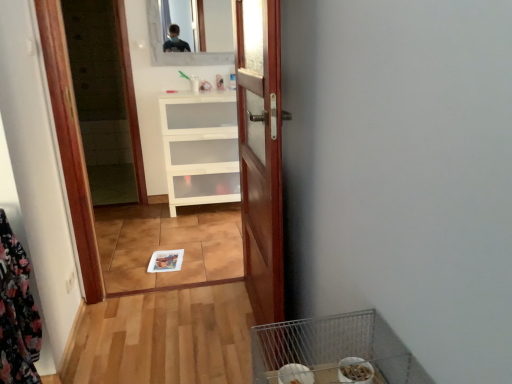
The image size is (512, 384). Find the location of `vacant space situated on the left part of wooden door at center`. vacant space situated on the left part of wooden door at center is located at coordinates (188, 331).